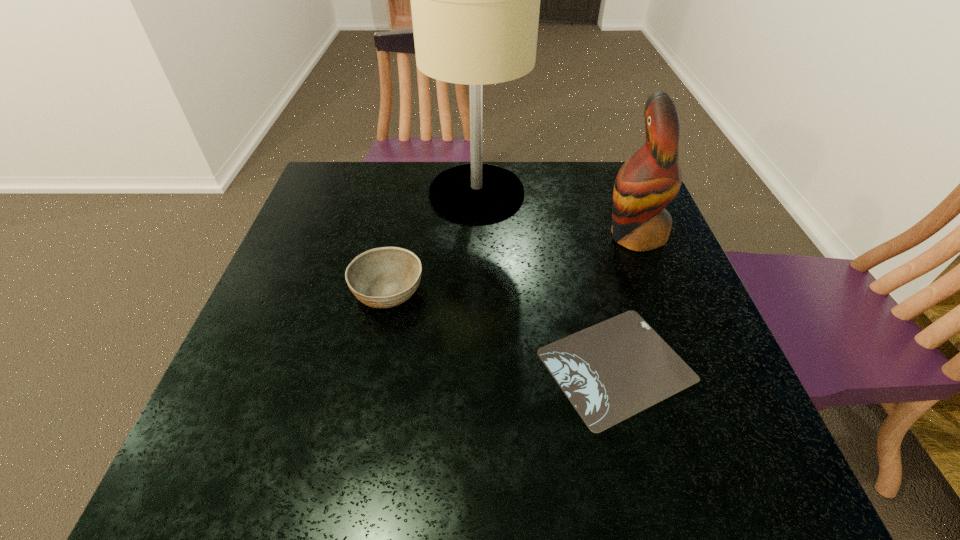
The height and width of the screenshot is (540, 960). I want to click on table lamp, so click(x=475, y=0).

The width and height of the screenshot is (960, 540). I want to click on the second tallest object, so click(647, 182).

I want to click on the third tallest object, so click(x=385, y=277).

Where is `the shortest object`? the shortest object is located at coordinates click(609, 372).

In order to click on vacant space located on the front of the table lamp in this screenshot , I will do `click(475, 319)`.

The image size is (960, 540). Identify the location of vacant space located on the face of the second tallest object. (463, 235).

At what (x,y) coordinates should I click in order to perform the action: click on free space located 0.150m on the face of the second tallest object. Please return your answer as a coordinate pair (x, y). Looking at the image, I should click on (544, 235).

You are a GUI agent. You are given a task and a screenshot of the screen. Output one action in this format:
    pyautogui.click(x=<x>, y=<y>)
    Task: Click on the free space located on the face of the second tallest object
    Image resolution: width=960 pixels, height=540 pixels.
    Given the screenshot: What is the action you would take?
    pyautogui.click(x=514, y=235)

Identify the location of vacant position located on the back of the bowl. (407, 197).

What are the coordinates of `blank space located 0.390m on the left of the shortest object` in the screenshot? It's located at (339, 365).